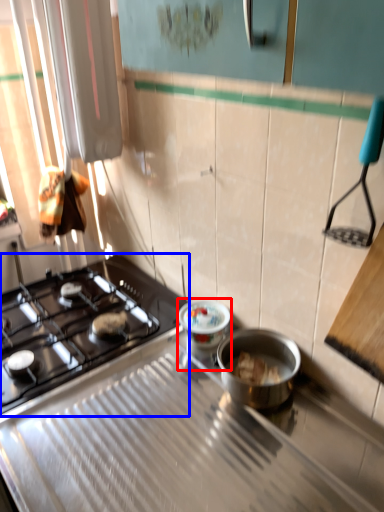
Question: Which object is further to the camera taking this photo, appliance (highlighted by a red box) or gas stove (highlighted by a blue box)?

Choices:
 (A) appliance
 (B) gas stove

Answer: (A)